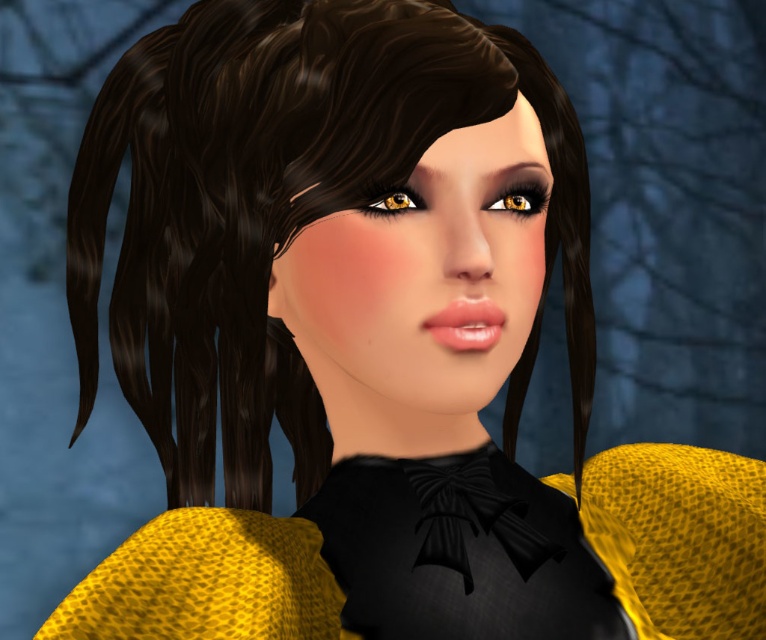
You are an artist trying to replicate the character design. You need to position the golden matte eye at center and the matte yellow eye at upper center correctly. Based on the scene description, which eye should be placed higher?

The golden matte eye at center is located above the matte yellow eye at upper center, so the golden matte eye at center should be placed higher.